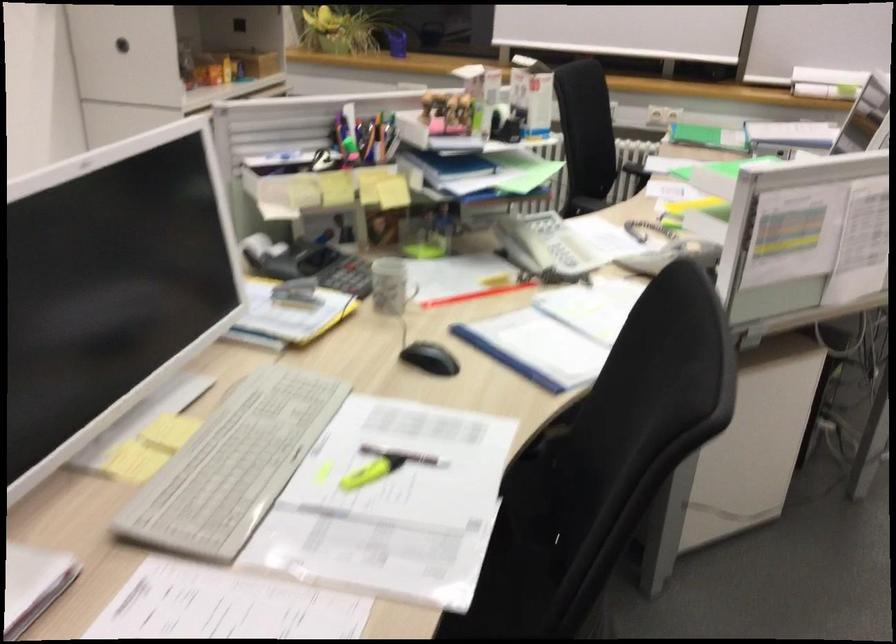
Identify the location of round cabinet handle. This screenshot has width=896, height=644. (122, 44).